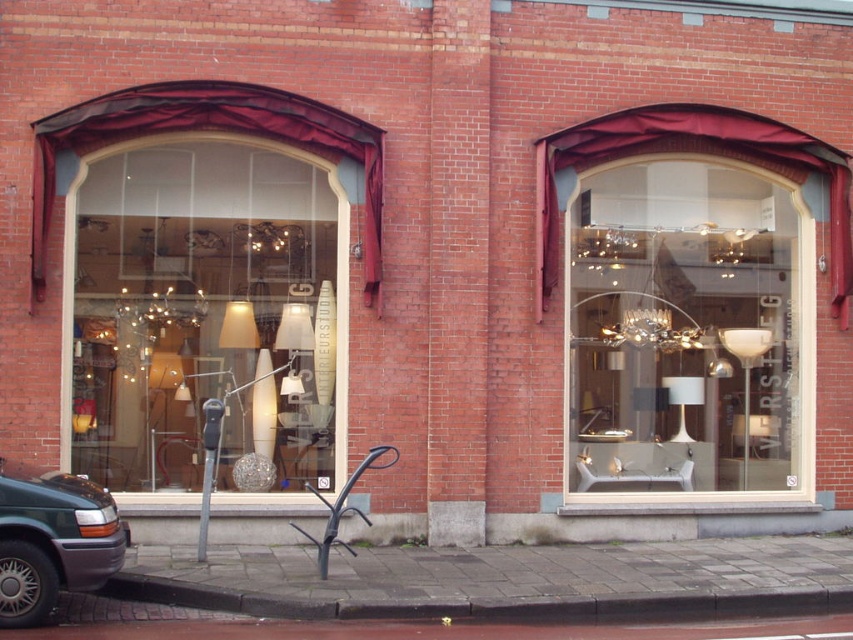
You are a delivery driver who needs to park your metallic gray van at lower left close to the storefront. The velvet burgundy curtain at upper left might block the view of the storefront from the van. Is there a risk that the curtain could obstruct your view of the storefront when parked?

The velvet burgundy curtain at upper left might be wider than the metallic gray van at lower left, which could potentially block the view of the storefront from the van. It is advisable to check the positioning carefully to avoid any obstruction.

You are standing in front of the shop and notice two points marked on the windows. The first point is at coordinates point (90, 144) and the second is at point (38, 496). Which point is closer to your eyes?

Point (90, 144) is further to the camera than point (38, 496), so the point closer to your eyes is point (38, 496).